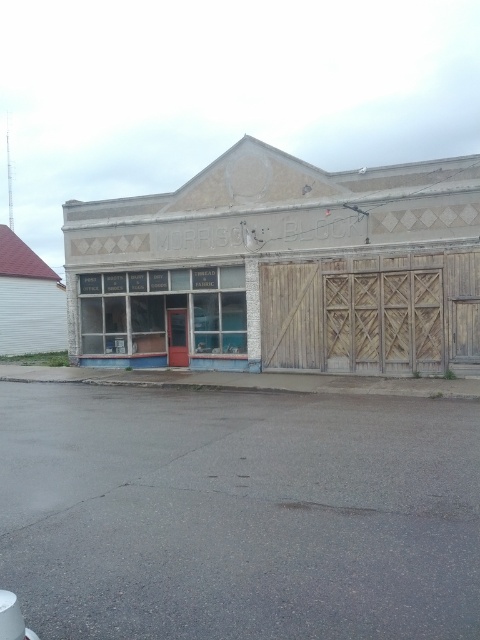
Question: Based on their relative distances, which object is nearer to the wooden at right?

Choices:
 (A) white painted wood storefront at center
 (B) red wood door at center

Answer: (A)

Question: Observing the image, what is the correct spatial positioning of wooden at right in reference to red wood door at center?

Choices:
 (A) right
 (B) left

Answer: (A)

Question: Considering the relative positions of white painted wood storefront at center and red wood door at center in the image provided, where is white painted wood storefront at center located with respect to red wood door at center?

Choices:
 (A) above
 (B) below

Answer: (A)

Question: Does wooden at right appear on the right side of red wood door at center?

Choices:
 (A) yes
 (B) no

Answer: (A)

Question: Which point is farther to the camera?

Choices:
 (A) (475, 244)
 (B) (382, 353)

Answer: (B)

Question: Considering the real-world distances, which object is farthest from the white painted wood storefront at center?

Choices:
 (A) wooden at right
 (B) red wood door at center

Answer: (A)